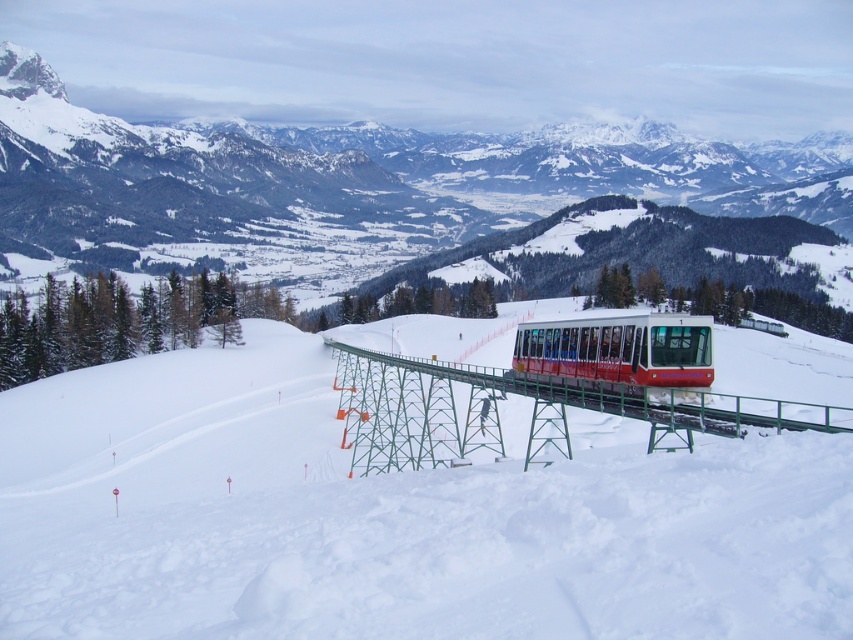
You are a hiker planning to walk from the white snow ski slope at center to the red matte train at center. Given that the distance between them is 43.75 meters, and your walking speed is 1.5 meters per second, how many seconds will it take you to reach the train?

The distance between the white snow ski slope at center and the red matte train at center is 43.75 meters. At a walking speed of 1.5 meters per second, the time required is 43.75 divided by 1.5, which equals approximately 29.17 seconds. Therefore, it will take about 29.17 seconds to reach the train.

You are planning to take a photo of the white snow ski slope at center and the red matte train at center from a distance. Which object will appear wider in the photo?

The white snow ski slope at center will appear wider in the photo since its width surpasses that of the red matte train at center.